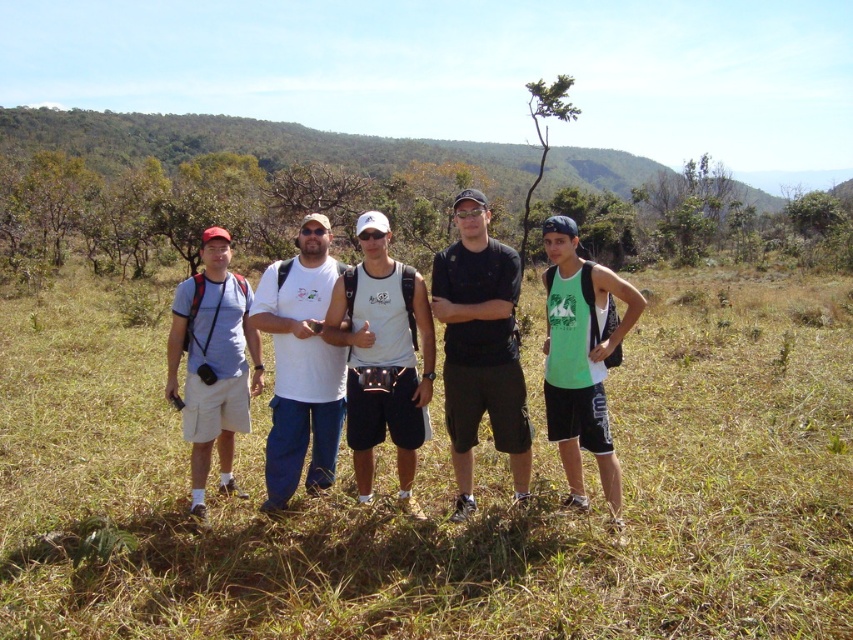
Question: Does white mesh tank top at center appear on the left side of white cotton t-shirt at center?

Choices:
 (A) no
 (B) yes

Answer: (A)

Question: Which point is closer to the camera?

Choices:
 (A) white mesh tank top at center
 (B) black matte t-shirt at center
 (C) matte blue shirt at left
 (D) white cotton t-shirt at center

Answer: (B)

Question: Is white mesh tank top at center smaller than matte blue shirt at left?

Choices:
 (A) yes
 (B) no

Answer: (B)

Question: Which of the following is the farthest from the observer?

Choices:
 (A) black matte t-shirt at center
 (B) white mesh tank top at center
 (C) green fabric tank top at center

Answer: (B)

Question: Is white mesh tank top at center bigger than green fabric tank top at center?

Choices:
 (A) no
 (B) yes

Answer: (A)

Question: Which point is farther to the camera?

Choices:
 (A) (196, 346)
 (B) (401, 321)
 (C) (556, 365)

Answer: (A)